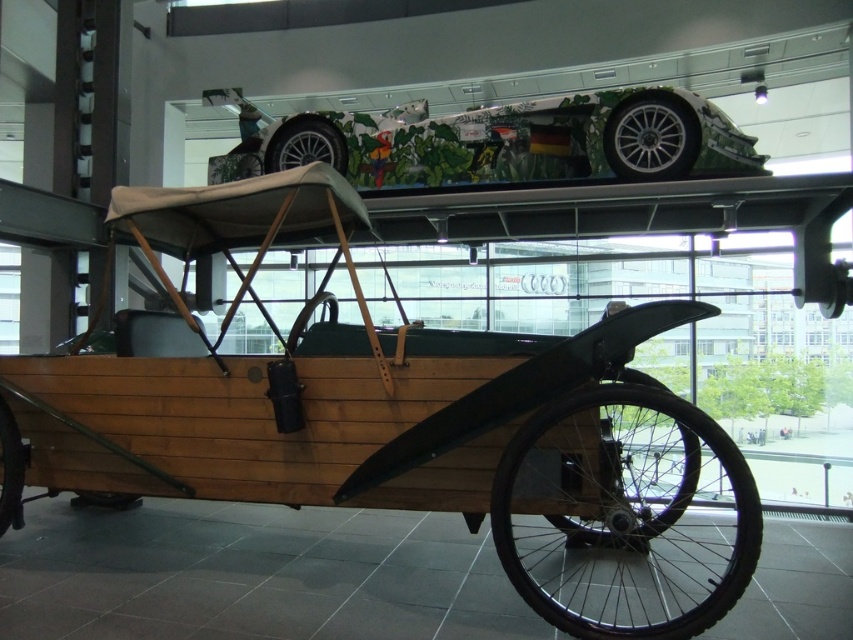
You are an event planner setting up a booth in the exhibition space. You need to place a 3D model of a car that is 2 meters wide. Which object between the wooden tricycle at lower left and the green leafy paintwork at upper center would allow enough space for the model without overlapping?

The wooden tricycle at lower left occupies less space than the green leafy paintwork at upper center. Therefore, placing the 3D model near the wooden tricycle at lower left would provide sufficient space as it takes up less area compared to the green leafy paintwork at upper center.